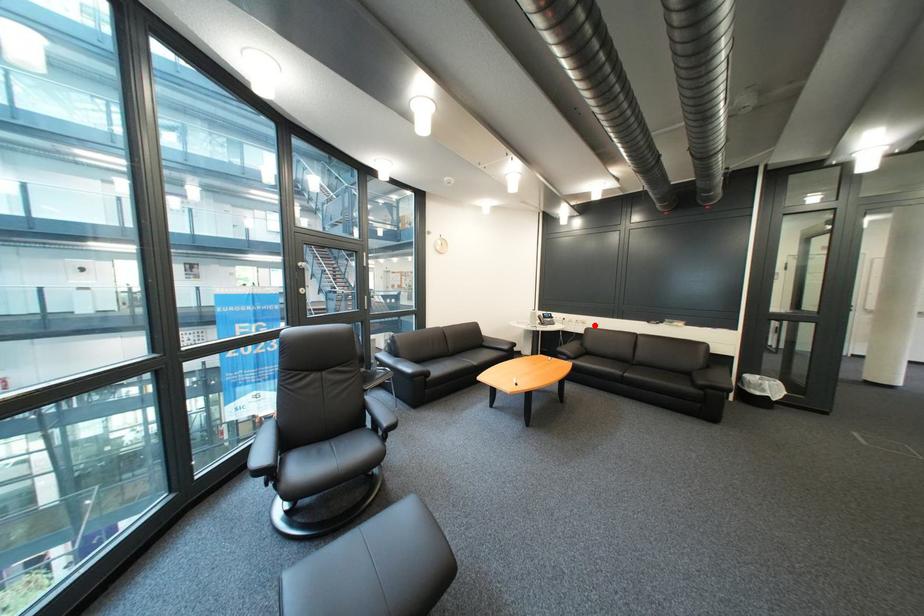
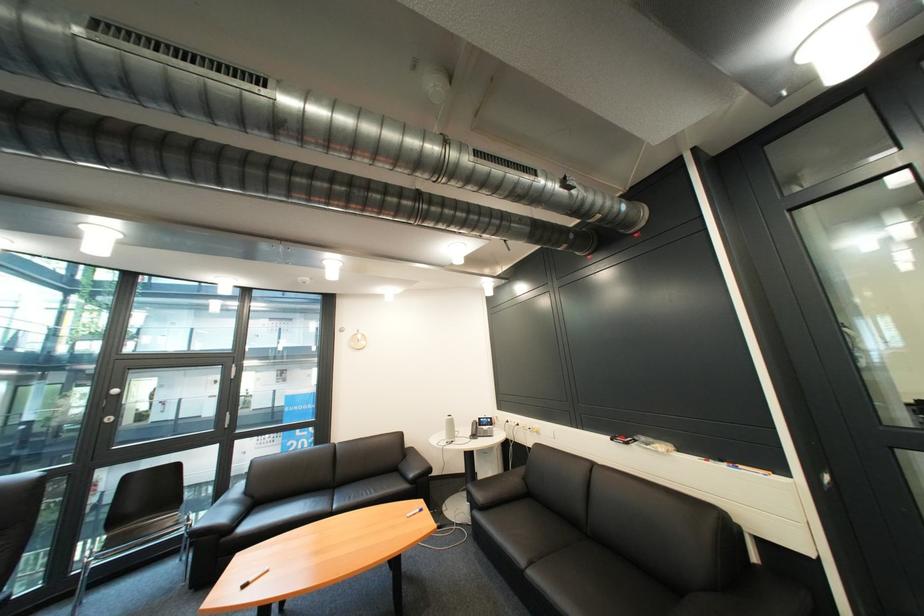
Where in the second image is the point corresponding to the highlighted location from the first image?

(549, 435)